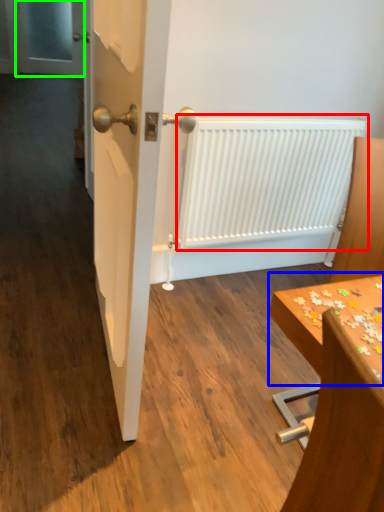
Question: Which is farther away from radiator (highlighted by a red box)? table (highlighted by a blue box) or screen door (highlighted by a green box)?

Choices:
 (A) table
 (B) screen door

Answer: (B)